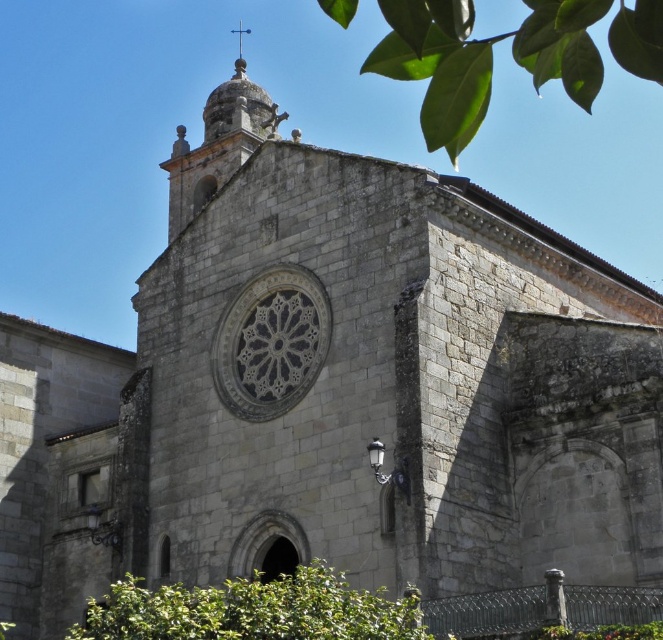
Can you confirm if green leafy tree at upper center is bigger than green leafy bush at lower center?

Indeed, green leafy tree at upper center has a larger size compared to green leafy bush at lower center.

Measure the distance between point (483,42) and camera.

Point (483,42) and camera are 18.19 meters apart from each other.

Does point (589, 76) come farther from viewer compared to point (139, 586)?

No, (589, 76) is closer to viewer.

This screenshot has width=663, height=640. I want to click on green leafy tree at upper center, so click(483, 58).

Measure the distance between green leafy bush at lower center and carved stone rose window at center.

56.64 feet

Consider the image. Which of these two, green leafy bush at lower center or carved stone rose window at center, stands shorter?

With less height is carved stone rose window at center.

Does point (143, 609) lie in front of point (243, 413)?

Yes, it is in front of point (243, 413).

Find the location of a particular element. Image resolution: width=663 pixels, height=640 pixels. green leafy bush at lower center is located at coordinates (253, 609).

Who is lower down, green leafy tree at upper center or carved stone rose window at center?

carved stone rose window at center is lower down.

Who is more forward, (516, 51) or (322, 358)?

Point (516, 51) is more forward.

Where is `green leafy tree at upper center`? Image resolution: width=663 pixels, height=640 pixels. green leafy tree at upper center is located at coordinates (483, 58).